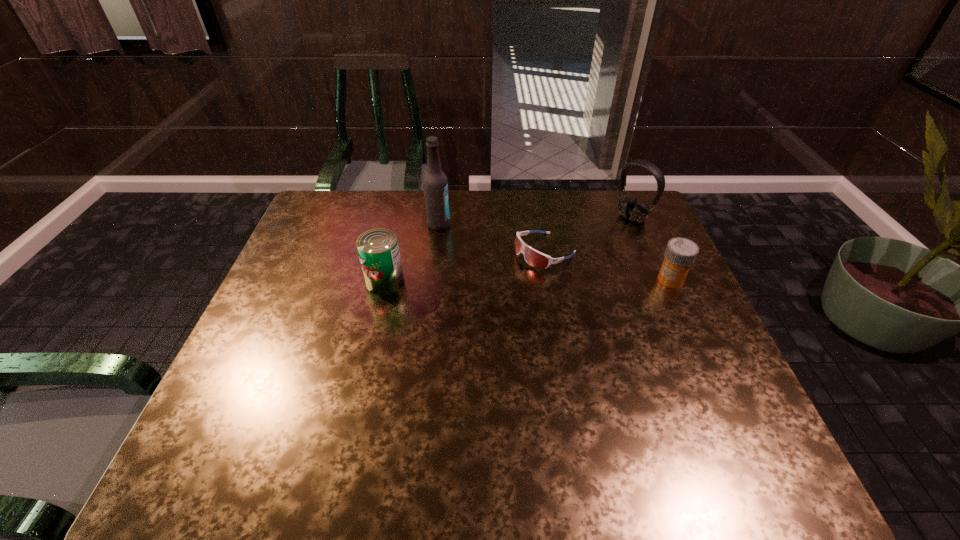
I want to click on vacant space located on the label of the fourth object from right to left, so click(465, 237).

Where is `headset present at the far edge`? The width and height of the screenshot is (960, 540). headset present at the far edge is located at coordinates (628, 208).

In order to click on beer bottle located in the far edge section of the desktop in this screenshot , I will do `click(435, 185)`.

Image resolution: width=960 pixels, height=540 pixels. Identify the location of medicine situated at the right edge. (680, 254).

Locate an element on the screen. headset at the right edge is located at coordinates (628, 208).

Where is `object that is at the far right corner`? The width and height of the screenshot is (960, 540). object that is at the far right corner is located at coordinates (628, 208).

The height and width of the screenshot is (540, 960). Find the location of `free space at the far edge of the desktop`. free space at the far edge of the desktop is located at coordinates (454, 231).

Locate an element on the screen. vacant area at the near edge is located at coordinates (654, 416).

You are a GUI agent. You are given a task and a screenshot of the screen. Output one action in this format:
    pyautogui.click(x=<x>, y=<y>)
    Task: Click on the vacant space at the left edge of the desktop
    This screenshot has height=540, width=960.
    Given the screenshot: What is the action you would take?
    pyautogui.click(x=279, y=295)

Find the location of a particular element. vacant space at the right edge of the desktop is located at coordinates (643, 258).